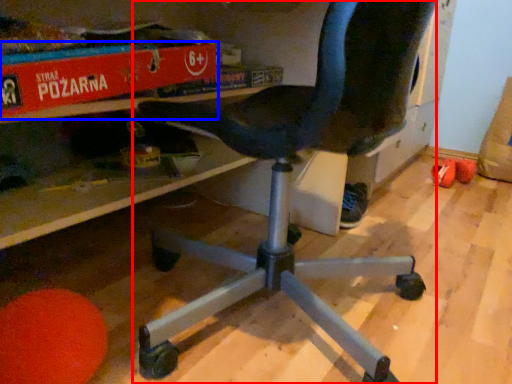
Question: Among these objects, which one is farthest to the camera, chair (highlighted by a red box) or paperback book (highlighted by a blue box)?

Choices:
 (A) chair
 (B) paperback book

Answer: (B)